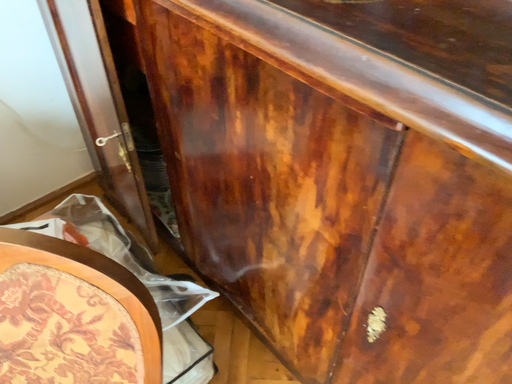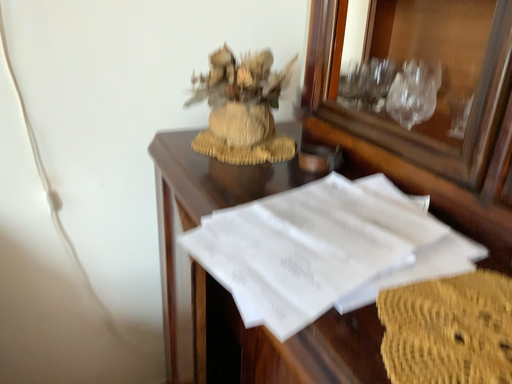
Question: Which way did the camera rotate in the video?

Choices:
 (A) rotated right
 (B) rotated left

Answer: (B)